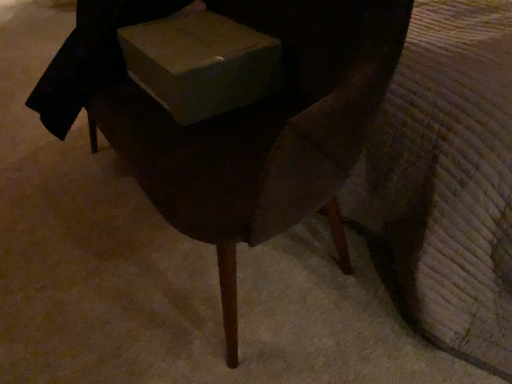
Question: From the image's perspective, is wooden chair at center above matte cardboard box at center?

Choices:
 (A) yes
 (B) no

Answer: (B)

Question: Is wooden chair at center in contact with matte cardboard box at center?

Choices:
 (A) no
 (B) yes

Answer: (A)

Question: Are wooden chair at center and matte cardboard box at center far apart?

Choices:
 (A) no
 (B) yes

Answer: (A)

Question: From the image's perspective, would you say wooden chair at center is shown under matte cardboard box at center?

Choices:
 (A) no
 (B) yes

Answer: (B)

Question: Can you confirm if wooden chair at center is bigger than matte cardboard box at center?

Choices:
 (A) yes
 (B) no

Answer: (A)

Question: Does wooden chair at center have a smaller size compared to matte cardboard box at center?

Choices:
 (A) yes
 (B) no

Answer: (B)

Question: Does matte cardboard box at center contain wooden chair at center?

Choices:
 (A) no
 (B) yes

Answer: (A)

Question: Is matte cardboard box at center at the left side of wooden chair at center?

Choices:
 (A) no
 (B) yes

Answer: (A)

Question: Is matte cardboard box at center positioned in front of wooden chair at center?

Choices:
 (A) yes
 (B) no

Answer: (B)

Question: Is matte cardboard box at center taller than wooden chair at center?

Choices:
 (A) no
 (B) yes

Answer: (A)

Question: From a real-world perspective, does matte cardboard box at center stand above wooden chair at center?

Choices:
 (A) yes
 (B) no

Answer: (A)

Question: Can you confirm if matte cardboard box at center is wider than wooden chair at center?

Choices:
 (A) no
 (B) yes

Answer: (A)

Question: Considering the positions of matte cardboard box at center and wooden chair at center in the image, is matte cardboard box at center bigger or smaller than wooden chair at center?

Choices:
 (A) small
 (B) big

Answer: (A)